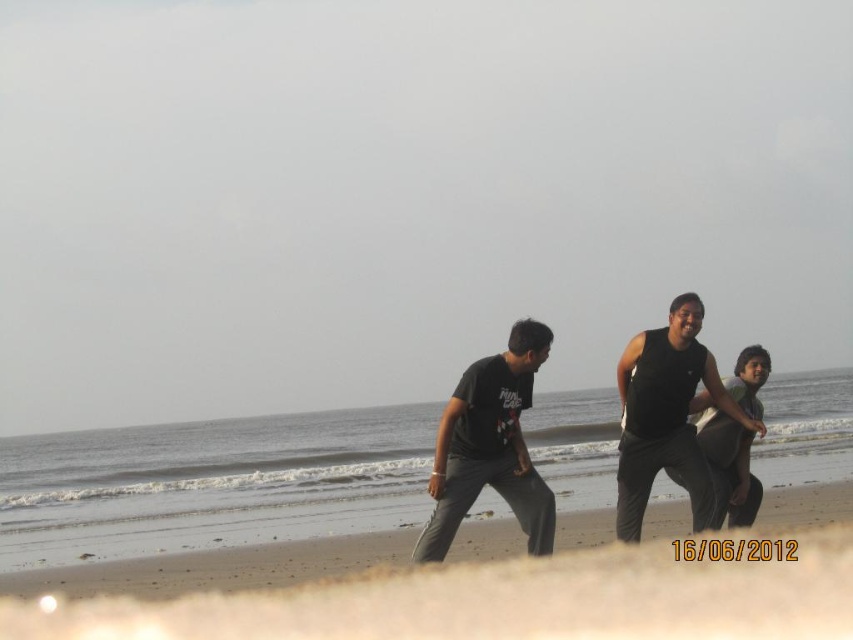
Question: Can you confirm if brown sandy beach at lower center is positioned to the right of dark gray jeans at center?

Choices:
 (A) yes
 (B) no

Answer: (B)

Question: Among these objects, which one is farthest from the camera?

Choices:
 (A) black matte t-shirt at center
 (B) black matte tank top at center
 (C) dark gray jeans at center
 (D) brown sandy beach at lower center

Answer: (C)

Question: Which of the following is the closest to the observer?

Choices:
 (A) (712, 452)
 (B) (433, 464)

Answer: (A)

Question: Is black matte t-shirt at center positioned at the back of black matte tank top at center?

Choices:
 (A) yes
 (B) no

Answer: (B)

Question: Which point is farther to the camera?

Choices:
 (A) (683, 628)
 (B) (747, 506)
 (C) (634, 440)

Answer: (B)

Question: Does brown sandy beach at lower center have a lesser width compared to dark gray jeans at center?

Choices:
 (A) no
 (B) yes

Answer: (A)